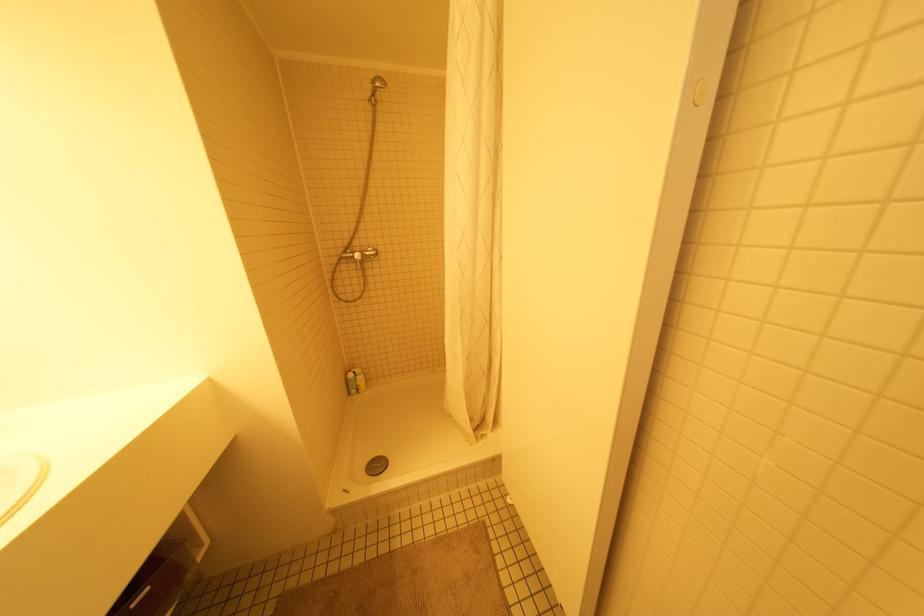
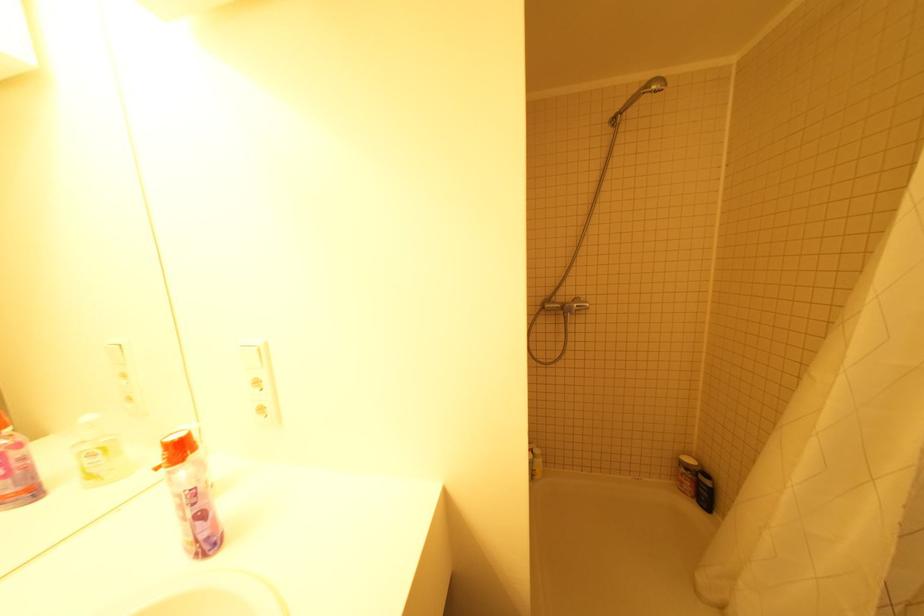
Question: The camera is either moving clockwise (left) or counter-clockwise (right) around the object. The first image is from the beginning of the video and the second image is from the end. Is the camera moving left or right when shooting the video?

Choices:
 (A) Left
 (B) Right

Answer: (B)